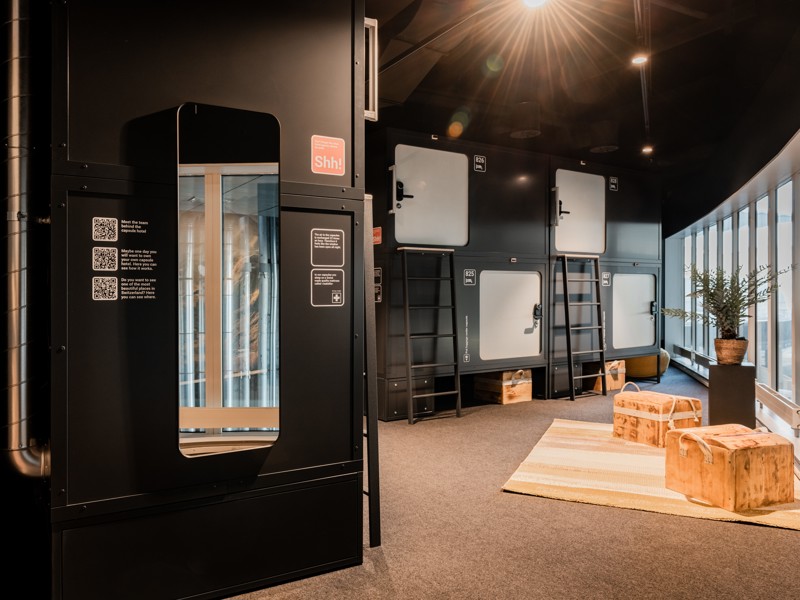
I want to click on wall, so click(529, 212), click(652, 242), click(734, 160).